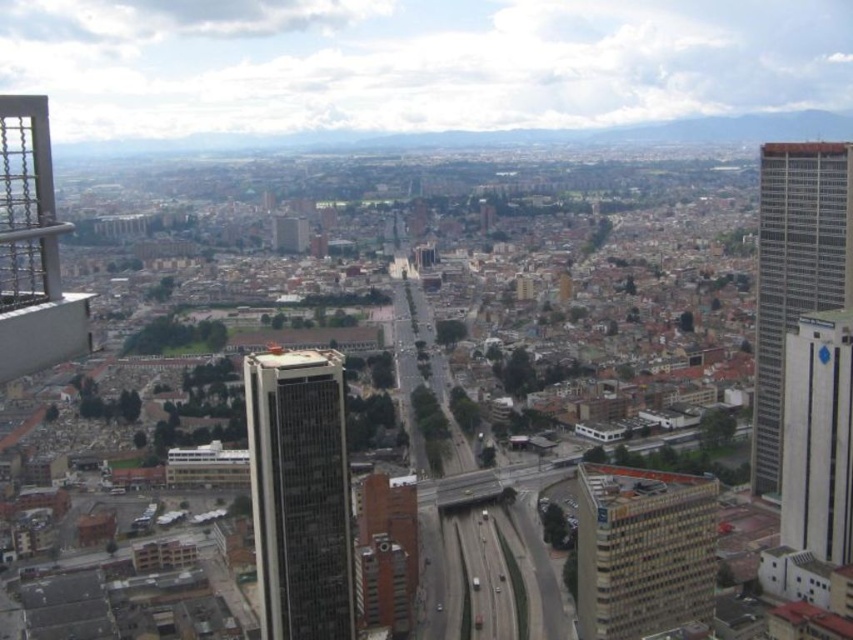
Question: Considering the real-world distances, which object is closest to the white glossy building at right?

Choices:
 (A) gray glass skyscraper at right
 (B) glassy gray skyscraper at center

Answer: (A)

Question: Is beige textured building at center to the left of white glossy building at right from the viewer's perspective?

Choices:
 (A) yes
 (B) no

Answer: (A)

Question: Which object appears closest to the camera in this image?

Choices:
 (A) gray glass skyscraper at right
 (B) glassy gray skyscraper at center

Answer: (B)

Question: Can you confirm if gray glass skyscraper at right is positioned above white glossy building at right?

Choices:
 (A) yes
 (B) no

Answer: (A)

Question: Can you confirm if glassy gray skyscraper at center is positioned above beige textured building at center?

Choices:
 (A) no
 (B) yes

Answer: (B)

Question: Among these objects, which one is nearest to the camera?

Choices:
 (A) gray glass skyscraper at right
 (B) white glossy building at right
 (C) glassy gray skyscraper at center

Answer: (C)